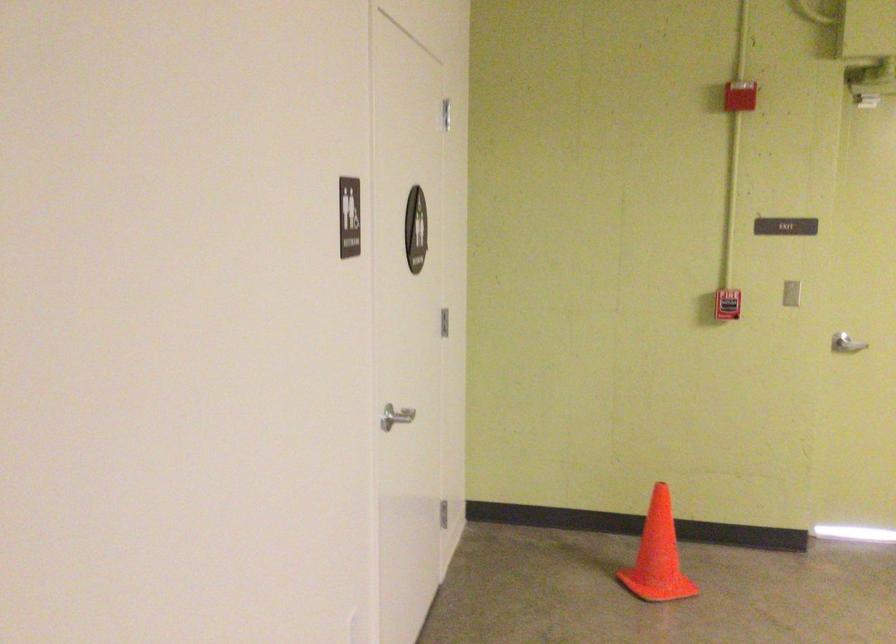
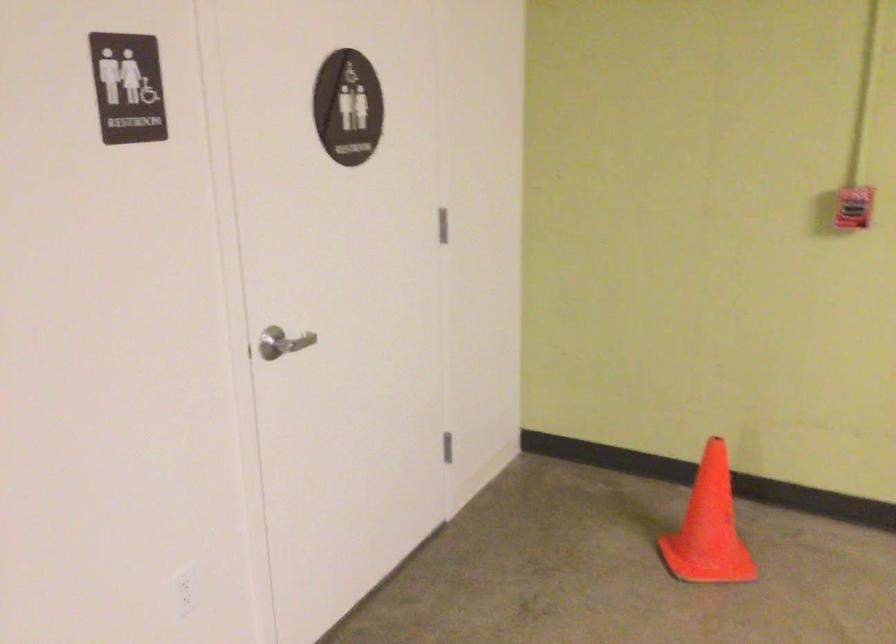
Locate, in the second image, the point that corresponds to point (393, 426) in the first image.

(281, 343)